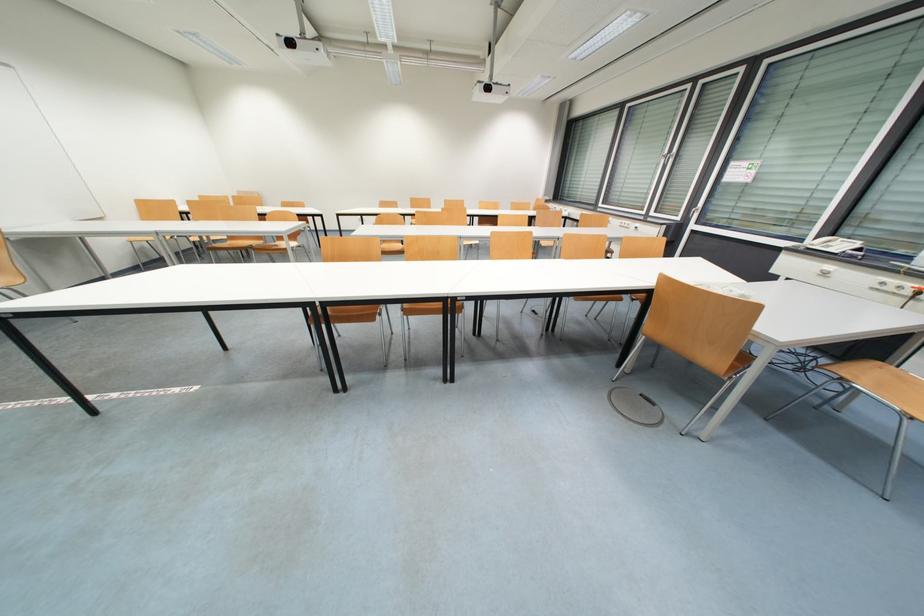
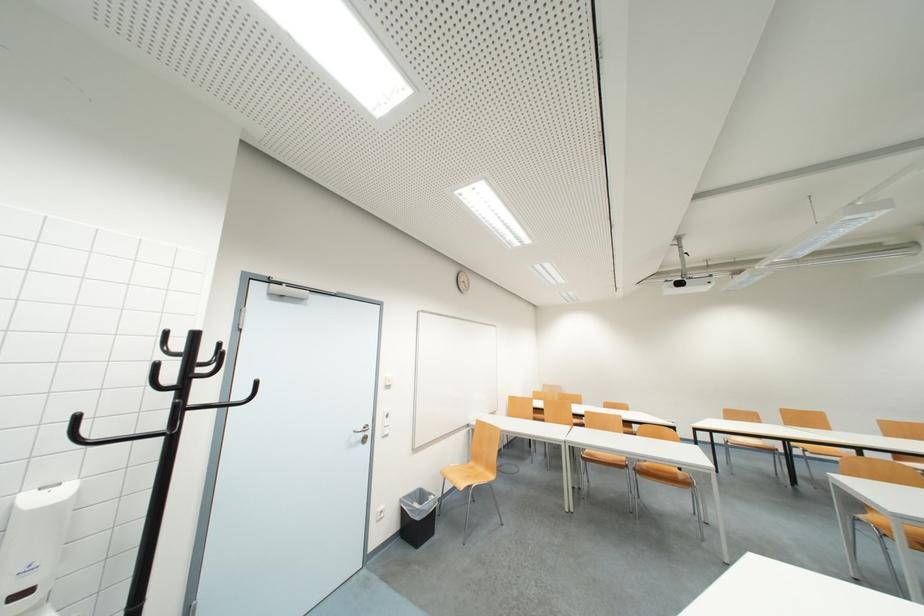
Locate, in the second image, the point that corresponds to the point at 215,251 in the first image.

(590, 461)